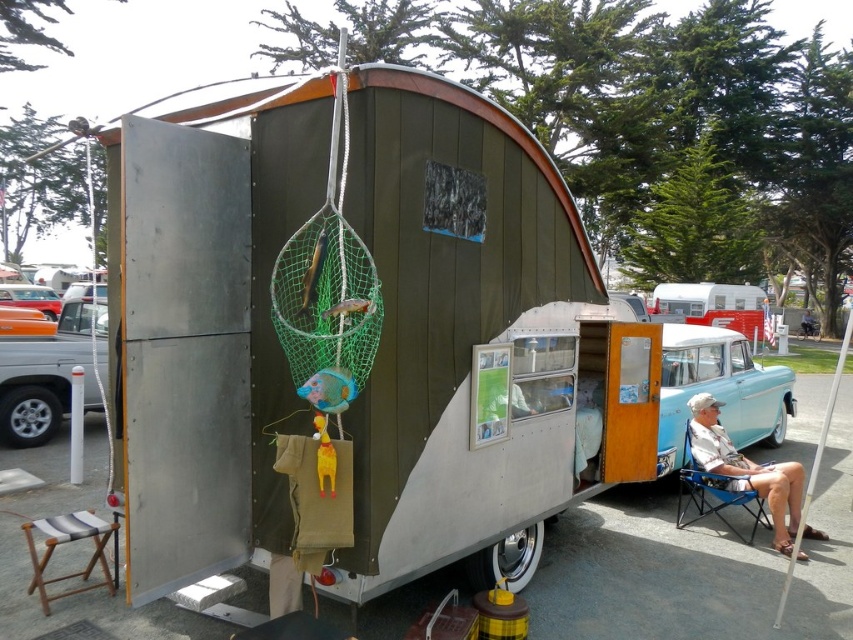
Question: Where is brushed metal truck at left located in relation to striped fabric stool at lower left in the image?

Choices:
 (A) above
 (B) below

Answer: (A)

Question: Does white fabric chair at lower right appear on the left side of orange glossy car at left?

Choices:
 (A) no
 (B) yes

Answer: (A)

Question: Considering the real-world distances, which object is farthest from the brushed metal truck at left?

Choices:
 (A) light blue vintage car at right
 (B) blue fabric chair at lower right
 (C) striped fabric stool at lower left
 (D) orange glossy car at left

Answer: (A)

Question: Among these points, which one is nearest to the camera?

Choices:
 (A) (42, 564)
 (B) (3, 413)

Answer: (A)

Question: Is striped fabric stool at lower left above orange glossy car at left?

Choices:
 (A) yes
 (B) no

Answer: (B)

Question: Which of these objects is positioned farthest from the striped fabric stool at lower left?

Choices:
 (A) orange glossy car at left
 (B) white fabric chair at lower right
 (C) orange matte car at left

Answer: (C)